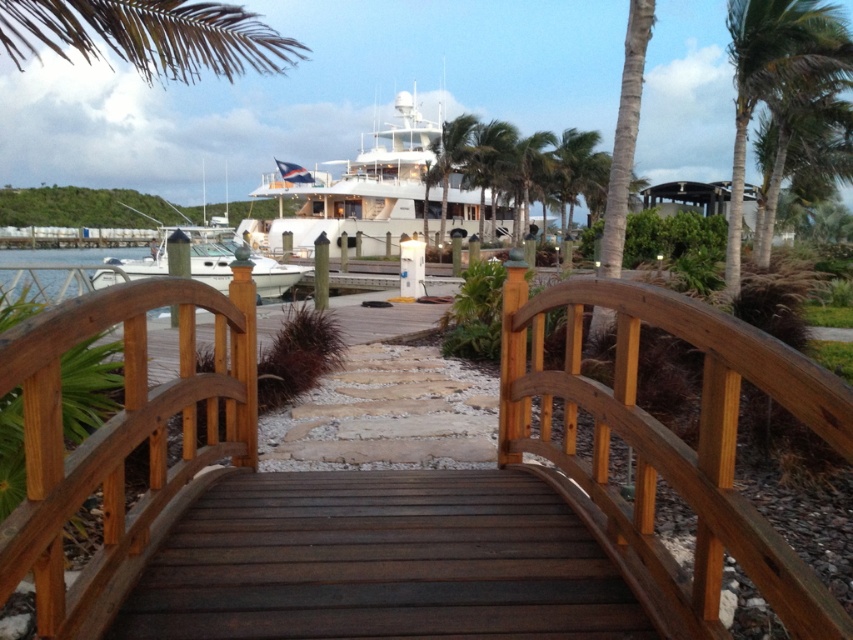
Question: Which object appears closest to the camera in this image?

Choices:
 (A) brown wooden bridge at center
 (B) white glossy yacht at upper center

Answer: (A)

Question: Can you confirm if green leafy palm tree at upper right is bigger than white glossy boat at center?

Choices:
 (A) yes
 (B) no

Answer: (B)

Question: Which point is closer to the camera?

Choices:
 (A) (515, 397)
 (B) (399, 154)

Answer: (A)

Question: Does green leafy palm tree at upper right have a lesser width compared to green leafy palm tree at upper center?

Choices:
 (A) no
 (B) yes

Answer: (A)

Question: Is green leafy palm tree at upper right positioned before green leafy palm tree at upper center?

Choices:
 (A) yes
 (B) no

Answer: (A)

Question: Among these points, which one is nearest to the camera?

Choices:
 (A) (218, 241)
 (B) (824, 51)
 (C) (567, 177)
 (D) (373, 228)

Answer: (B)